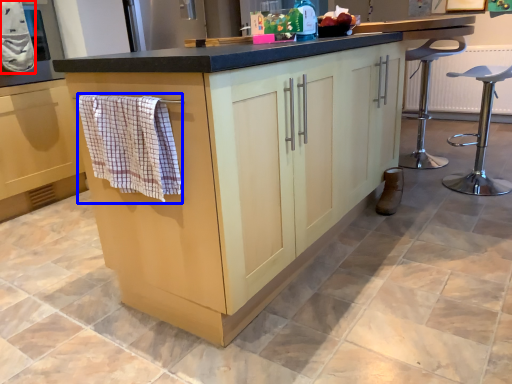
Question: Which object is further to the camera taking this photo, bath towel (highlighted by a red box) or bath towel (highlighted by a blue box)?

Choices:
 (A) bath towel
 (B) bath towel

Answer: (A)